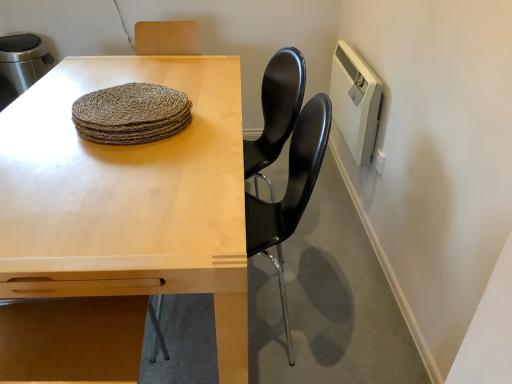
In the scene shown: What is the approximate width of light wood table at center?

light wood table at center is 34.28 inches in width.

I want to click on light wood table at center, so click(x=129, y=196).

What do you see at coordinates (355, 101) in the screenshot? I see `white plastic radiator at upper right` at bounding box center [355, 101].

The width and height of the screenshot is (512, 384). What do you see at coordinates (131, 114) in the screenshot? I see `natural woven placemat at center` at bounding box center [131, 114].

Where is `light wood table at center`? This screenshot has width=512, height=384. light wood table at center is located at coordinates (129, 196).

Is natural woven placemat at center inside the boundaries of black glossy chair at center, or outside?

natural woven placemat at center is not inside black glossy chair at center, it's outside.

Is point (118, 86) positioned in front of point (296, 167)?

No, it is not.

Can you confirm if natural woven placemat at center is positioned to the right of black glossy chair at center?

Incorrect, natural woven placemat at center is not on the right side of black glossy chair at center.

At what (x,y) coordinates should I click in order to perform the action: click on table lying in front of the natural woven placemat at center. Please return your answer as a coordinate pair (x, y). The height and width of the screenshot is (384, 512). Looking at the image, I should click on (129, 196).

Considering the points (30, 121) and (170, 109), which point is behind, point (30, 121) or point (170, 109)?

Positioned behind is point (30, 121).

Which object is closer to the camera taking this photo, light wood table at center or natural woven placemat at center?

light wood table at center is in front.

Does light wood table at center contain natural woven placemat at center?

No, natural woven placemat at center is not inside light wood table at center.

Is black glossy chair at center not near light wood table at center?

No.

Which object is more forward, black glossy chair at center or light wood table at center?

Positioned in front is light wood table at center.

From the image's perspective, is black glossy chair at center positioned above or below light wood table at center?

black glossy chair at center is below light wood table at center.

Which object is thinner, black glossy chair at center or light wood table at center?

black glossy chair at center.

This screenshot has width=512, height=384. Identify the location of appliance above the black glossy chair at center (from a real-world perspective). (355, 101).

Is black glossy chair at center closer to camera compared to white plastic radiator at upper right?

Yes, black glossy chair at center is closer to the viewer.

Considering the relative sizes of black glossy chair at center and white plastic radiator at upper right in the image provided, is black glossy chair at center taller than white plastic radiator at upper right?

Yes.

From a real-world perspective, is black glossy chair at center positioned above or below white plastic radiator at upper right?

From a real-world perspective, black glossy chair at center is physically below white plastic radiator at upper right.

Does natural woven placemat at center have a greater height compared to light wood table at center?

Incorrect, the height of natural woven placemat at center is not larger of that of light wood table at center.

Do you think natural woven placemat at center is within light wood table at center, or outside of it?

natural woven placemat at center is located beyond the bounds of light wood table at center.

Considering the sizes of objects natural woven placemat at center and light wood table at center in the image provided, who is bigger, natural woven placemat at center or light wood table at center?

Bigger between the two is light wood table at center.

Considering the points (162, 93) and (140, 150), which point is behind, point (162, 93) or point (140, 150)?

Positioned behind is point (162, 93).

Which object is closer to the camera taking this photo, white plastic radiator at upper right or black glossy chair at center?

black glossy chair at center is more forward.

Considering the sizes of objects white plastic radiator at upper right and black glossy chair at center in the image provided, who is shorter, white plastic radiator at upper right or black glossy chair at center?

Standing shorter between the two is white plastic radiator at upper right.

Which of these two, white plastic radiator at upper right or black glossy chair at center, is wider?

Wider between the two is black glossy chair at center.

From a real-world perspective, is white plastic radiator at upper right located higher than black glossy chair at center?

Correct, in the physical world, white plastic radiator at upper right is higher than black glossy chair at center.

Between light wood table at center and white plastic radiator at upper right, which one has less height?

Standing shorter between the two is white plastic radiator at upper right.

Is light wood table at center aimed at white plastic radiator at upper right?

No, light wood table at center does not turn towards white plastic radiator at upper right.

Which of these two, light wood table at center or white plastic radiator at upper right, is smaller?

white plastic radiator at upper right.

Would you say light wood table at center is a long distance from white plastic radiator at upper right?

No.

The width and height of the screenshot is (512, 384). Find the location of `chair that appears below the natural woven placemat at center (from a real-world perspective)`. chair that appears below the natural woven placemat at center (from a real-world perspective) is located at coordinates (290, 192).

Identify the location of food above the light wood table at center (from a real-world perspective). The width and height of the screenshot is (512, 384). (131, 114).

Estimate the real-world distances between objects in this image. Which object is further from natural woven placemat at center, light wood table at center or white plastic radiator at upper right?

Among the two, white plastic radiator at upper right is located further to natural woven placemat at center.

Looking at the image, which one is located closer to natural woven placemat at center, white plastic radiator at upper right or black glossy chair at center?

black glossy chair at center is positioned closer to the anchor natural woven placemat at center.

Looking at this image, considering their positions, is black glossy chair at center positioned closer to natural woven placemat at center than light wood table at center?

light wood table at center.

Considering their positions, is black glossy chair at center positioned closer to white plastic radiator at upper right than natural woven placemat at center?

Among the two, black glossy chair at center is located nearer to white plastic radiator at upper right.

Considering their positions, is natural woven placemat at center positioned further to white plastic radiator at upper right than light wood table at center?

natural woven placemat at center.

From the image, which object appears to be farther from white plastic radiator at upper right, black glossy chair at center or light wood table at center?

light wood table at center lies further to white plastic radiator at upper right than the other object.

From the image, which object appears to be nearer to light wood table at center, white plastic radiator at upper right or black glossy chair at center?

black glossy chair at center is closer to light wood table at center.

Estimate the real-world distances between objects in this image. Which object is further from black glossy chair at center, natural woven placemat at center or light wood table at center?

natural woven placemat at center is positioned further to the anchor black glossy chair at center.

Find the location of a particular element. The image size is (512, 384). chair between natural woven placemat at center and white plastic radiator at upper right is located at coordinates (290, 192).

Locate an element on the screen. The image size is (512, 384). chair between light wood table at center and white plastic radiator at upper right along the z-axis is located at coordinates coord(290,192).

Where is `food situated between light wood table at center and black glossy chair at center from left to right`? food situated between light wood table at center and black glossy chair at center from left to right is located at coordinates (131, 114).

Identify the location of food between light wood table at center and white plastic radiator at upper right. The height and width of the screenshot is (384, 512). (131, 114).